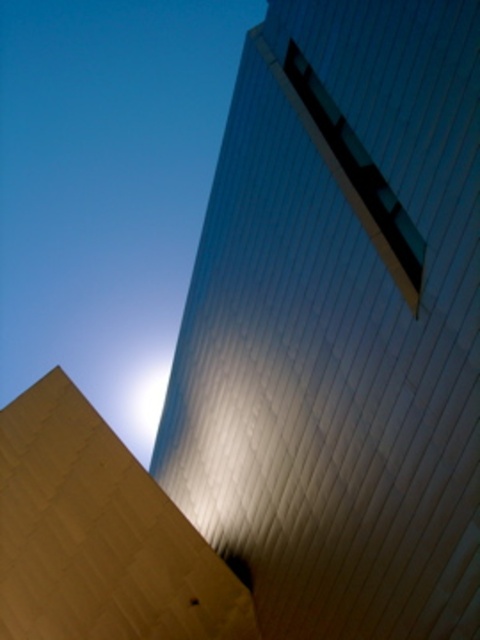
Question: Does matte beige pyramid at lower left appear on the right side of matte beige pyramid at center?

Choices:
 (A) yes
 (B) no

Answer: (A)

Question: Which of the following is the farthest from the observer?

Choices:
 (A) matte beige pyramid at center
 (B) matte beige pyramid at lower left

Answer: (A)

Question: Can you confirm if matte beige pyramid at lower left is positioned below matte beige pyramid at center?

Choices:
 (A) no
 (B) yes

Answer: (A)

Question: Among these points, which one is farthest from the camera?

Choices:
 (A) pyautogui.click(x=59, y=604)
 (B) pyautogui.click(x=206, y=504)

Answer: (B)

Question: Can you confirm if matte beige pyramid at lower left is positioned below matte beige pyramid at center?

Choices:
 (A) no
 (B) yes

Answer: (A)